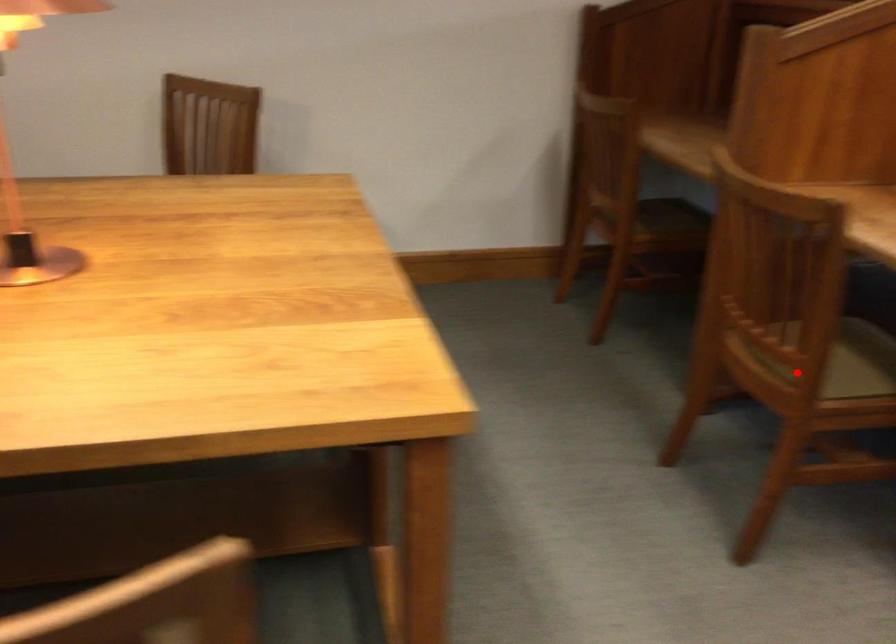
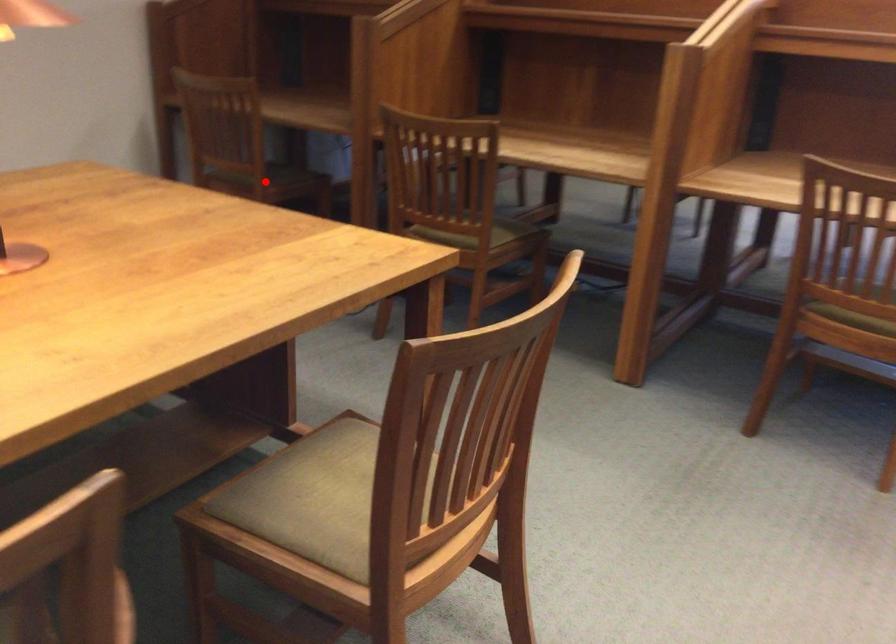
I am providing you with two images of the same scene from different viewpoints. A red point is marked on the first image and another point is marked on the second image. Is the marked point in image1 the same physical position as the marked point in image2?

No